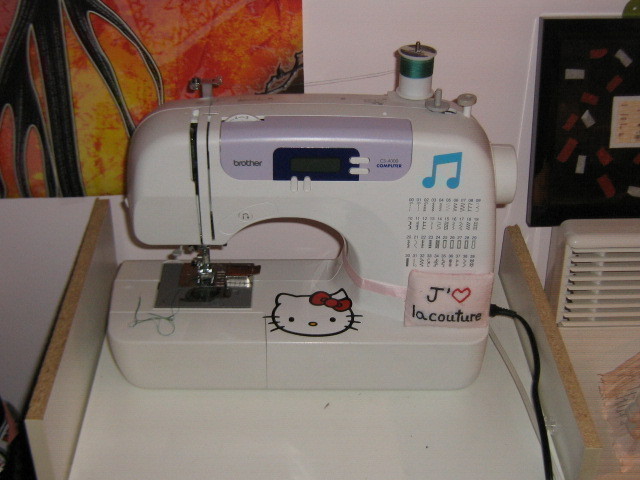
Identify the location of sewing machine foot. (202, 274).